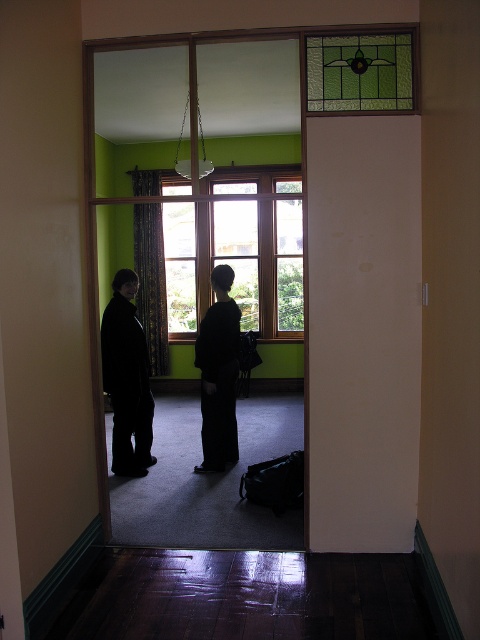
You are a delivery person who needs to place a package on the floor next to the black fabric couple at center. However, there is a black matte coat at center in the way. Can you slide the package between them?

The black fabric couple at center is above the black matte coat at center, so there is vertical space between them. However, since the coat is on the floor, sliding the package between them might be possible if there is enough horizontal space. But the description only mentions their vertical positioning. Without information about horizontal distance, it is uncertain.

You are a delivery person trying to enter the room through the doorway. You have a large box that is 1.2 meters wide. Can you fit the box through the doorway if you position it horizontally between the wooden frame window at center and the black matte coat at center?

The wooden frame window at center is larger than the black matte coat at center. Since the box is 1.2 meters wide and the space between them may be constrained by the smaller object, it might not fit. However, without exact measurements of the gap, it is uncertain. The description only states size comparison, not the actual space between them.